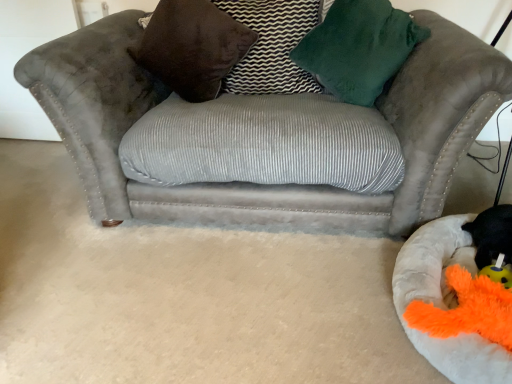
Find the location of `suede gray couch at center`. suede gray couch at center is located at coordinates (105, 117).

What do you see at coordinates (105, 117) in the screenshot? I see `suede gray couch at center` at bounding box center [105, 117].

Measure the distance between point (487, 277) and camera.

The depth of point (487, 277) is 1.26 meters.

What do you see at coordinates (467, 310) in the screenshot?
I see `orange fuzzy toy at lower right` at bounding box center [467, 310].

Identify the location of black plush toy at lower right. (492, 234).

In the image, is fluffy white dog bed at lower right positioned in front of or behind velvet brown pillow at center, acting as the 1th pillow starting from the right?

In the image, fluffy white dog bed at lower right appears in front of velvet brown pillow at center, acting as the 1th pillow starting from the right.

Which of these two, fluffy white dog bed at lower right or velvet brown pillow at center, which ranks as the second pillow in left-to-right order, is thinner?

velvet brown pillow at center, which ranks as the second pillow in left-to-right order, is thinner.

From the picture: Considering the positions of objects fluffy white dog bed at lower right and velvet brown pillow at center, which ranks as the second pillow in left-to-right order, in the image provided, who is more to the right, fluffy white dog bed at lower right or velvet brown pillow at center, which ranks as the second pillow in left-to-right order,?

fluffy white dog bed at lower right.

Is point (476, 253) closer or farther from the camera than point (255, 9)?

Point (476, 253) appears to be closer to the viewer than point (255, 9).

Is black plush toy at lower right bigger than velvet brown pillow at center, acting as the 1th pillow starting from the right?

No, black plush toy at lower right is not bigger than velvet brown pillow at center, acting as the 1th pillow starting from the right.

From the image's perspective, is black plush toy at lower right above or below velvet brown pillow at center, acting as the 1th pillow starting from the right?

black plush toy at lower right is below velvet brown pillow at center, acting as the 1th pillow starting from the right.

Is black plush toy at lower right looking in the opposite direction of velvet brown pillow at center, which ranks as the second pillow in left-to-right order?

No.

Is velvet brown pillow at center, acting as the 1th pillow starting from the right, wider than green velvet throw pillow at upper right?

No.

Does velvet brown pillow at center, acting as the 1th pillow starting from the right, contain green velvet throw pillow at upper right?

Definitely not — green velvet throw pillow at upper right is not inside velvet brown pillow at center, acting as the 1th pillow starting from the right.

Who is taller, velvet brown pillow at center, acting as the 1th pillow starting from the right, or green velvet throw pillow at upper right?

green velvet throw pillow at upper right.

Is velvet brown pillow at center, acting as the 1th pillow starting from the right, facing towards green velvet throw pillow at upper right?

No, velvet brown pillow at center, acting as the 1th pillow starting from the right, is not facing towards green velvet throw pillow at upper right.

Is point (395, 115) closer or farther from the camera than point (434, 245)?

Point (395, 115) is farther from the camera than point (434, 245).

Is suede gray couch at center behind fluffy white dog bed at lower right?

Yes, it is.

Is suede gray couch at center inside or outside of fluffy white dog bed at lower right?

suede gray couch at center is spatially situated outside fluffy white dog bed at lower right.

What are the coordinates of `dog bed on the right of suede gray couch at center` in the screenshot? It's located at (444, 303).

In order to click on pillow below the velvet brown pillow at center, acting as the 1th pillow starting from the right (from the image's perspective) in this screenshot , I will do `click(192, 47)`.

Looking at this image, is there a large distance between velvet brown pillow at center, which ranks as the second pillow in left-to-right order, and velvet brown pillow at upper center, which ranks as the second pillow in right-to-left order?

No, velvet brown pillow at center, which ranks as the second pillow in left-to-right order, is not far from velvet brown pillow at upper center, which ranks as the second pillow in right-to-left order.

Considering the relative sizes of velvet brown pillow at center, acting as the 1th pillow starting from the right, and velvet brown pillow at upper center, the 1th pillow from the left, in the image provided, is velvet brown pillow at center, acting as the 1th pillow starting from the right, thinner than velvet brown pillow at upper center, the 1th pillow from the left,?

Correct, the width of velvet brown pillow at center, acting as the 1th pillow starting from the right, is less than that of velvet brown pillow at upper center, the 1th pillow from the left.

From a real-world perspective, which object rests below the other?

In real-world perspective, suede gray couch at center is lower.

The width and height of the screenshot is (512, 384). What are the coordinates of `studio couch below the velvet brown pillow at center, acting as the 1th pillow starting from the right (from a real-world perspective)` in the screenshot? It's located at (105, 117).

Is velvet brown pillow at center, which ranks as the second pillow in left-to-right order, touching suede gray couch at center?

velvet brown pillow at center, which ranks as the second pillow in left-to-right order, and suede gray couch at center are not in contact.

Between orange fuzzy toy at lower right and suede gray couch at center, which one is positioned in front?

orange fuzzy toy at lower right is more forward.

This screenshot has height=384, width=512. I want to click on toy below the suede gray couch at center (from the image's perspective), so click(x=467, y=310).

Considering the sizes of objects orange fuzzy toy at lower right and suede gray couch at center in the image provided, who is taller, orange fuzzy toy at lower right or suede gray couch at center?

Standing taller between the two is suede gray couch at center.

Based on their sizes in the image, would you say orange fuzzy toy at lower right is bigger or smaller than suede gray couch at center?

orange fuzzy toy at lower right is smaller than suede gray couch at center.

You are a GUI agent. You are given a task and a screenshot of the screen. Output one action in this format:
    pyautogui.click(x=<x>, y=<y>)
    Task: Click on the dog bed directly beneath the velvet brown pillow at center, acting as the 1th pillow starting from the right (from a real-world perspective)
    
    Given the screenshot: What is the action you would take?
    pyautogui.click(x=444, y=303)

Where is `animal in front of the velvet brown pillow at center, acting as the 1th pillow starting from the right`? animal in front of the velvet brown pillow at center, acting as the 1th pillow starting from the right is located at coordinates (492, 234).

From the image, which object appears to be nearer to velvet brown pillow at center, which ranks as the second pillow in left-to-right order, black plush toy at lower right or green velvet throw pillow at upper right?

green velvet throw pillow at upper right lies closer to velvet brown pillow at center, which ranks as the second pillow in left-to-right order, than the other object.

From the image, which object appears to be farther from velvet brown pillow at upper center, which ranks as the second pillow in right-to-left order, fluffy white dog bed at lower right or velvet brown pillow at center, acting as the 1th pillow starting from the right?

Among the two, fluffy white dog bed at lower right is located further to velvet brown pillow at upper center, which ranks as the second pillow in right-to-left order.

Consider the image. When comparing their distances from orange fuzzy toy at lower right, does black plush toy at lower right or green velvet throw pillow at upper right seem closer?

black plush toy at lower right lies closer to orange fuzzy toy at lower right than the other object.

When comparing their distances from velvet brown pillow at center, acting as the 1th pillow starting from the right, does green velvet throw pillow at upper right or suede gray couch at center seem further?

suede gray couch at center is further to velvet brown pillow at center, acting as the 1th pillow starting from the right.

Based on their spatial positions, is green velvet throw pillow at upper right or orange fuzzy toy at lower right further from suede gray couch at center?

orange fuzzy toy at lower right lies further to suede gray couch at center than the other object.

Considering their positions, is velvet brown pillow at upper center, which ranks as the second pillow in right-to-left order, positioned further to suede gray couch at center than green velvet throw pillow at upper right?

velvet brown pillow at upper center, which ranks as the second pillow in right-to-left order, is further to suede gray couch at center.

Which object lies nearer to the anchor point fluffy white dog bed at lower right, velvet brown pillow at center, acting as the 1th pillow starting from the right, or velvet brown pillow at upper center, the 1th pillow from the left?

Among the two, velvet brown pillow at center, acting as the 1th pillow starting from the right, is located nearer to fluffy white dog bed at lower right.

Looking at the image, which one is located closer to velvet brown pillow at upper center, the 1th pillow from the left, black plush toy at lower right or suede gray couch at center?

suede gray couch at center lies closer to velvet brown pillow at upper center, the 1th pillow from the left, than the other object.

This screenshot has width=512, height=384. What are the coordinates of `studio couch that lies between velvet brown pillow at center, acting as the 1th pillow starting from the right, and orange fuzzy toy at lower right from top to bottom` in the screenshot? It's located at (105, 117).

Where is `toy situated between suede gray couch at center and black plush toy at lower right from left to right`? Image resolution: width=512 pixels, height=384 pixels. toy situated between suede gray couch at center and black plush toy at lower right from left to right is located at coordinates (467, 310).

This screenshot has height=384, width=512. Find the location of `animal that lies between green velvet throw pillow at upper right and orange fuzzy toy at lower right from top to bottom`. animal that lies between green velvet throw pillow at upper right and orange fuzzy toy at lower right from top to bottom is located at coordinates (492, 234).

You are a GUI agent. You are given a task and a screenshot of the screen. Output one action in this format:
    pyautogui.click(x=<x>, y=<y>)
    Task: Click on the studio couch between velvet brown pillow at upper center, the 1th pillow from the left, and orange fuzzy toy at lower right in the up-down direction
    Image resolution: width=512 pixels, height=384 pixels.
    Given the screenshot: What is the action you would take?
    pyautogui.click(x=105, y=117)